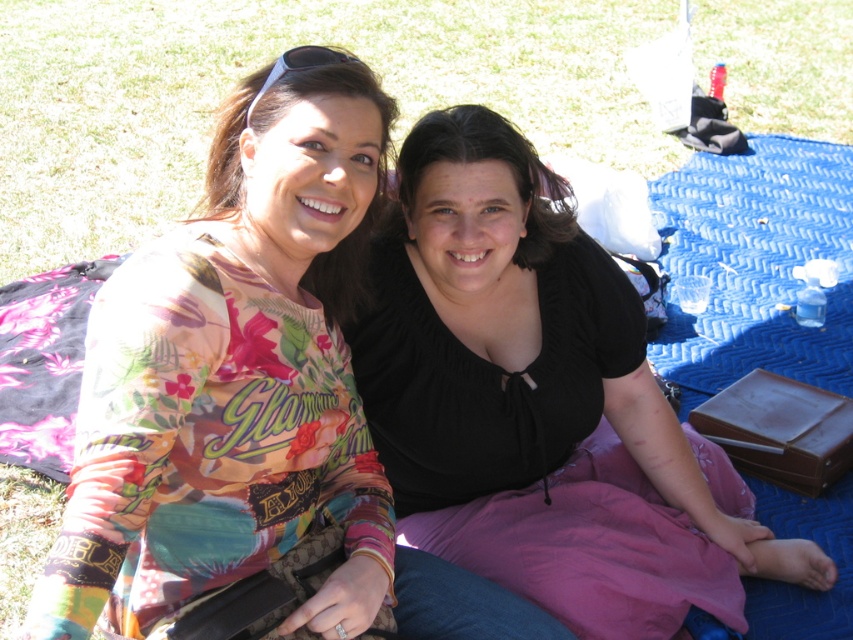
You are a photographer trying to capture a closeup of the floral printed shirt at center. Since the green grass at upper left is in the way, where should you position your camera relative to the shirt to avoid the grass blocking the view?

The floral printed shirt at center is below green grass at upper left, so positioning the camera above the shirt would allow you to capture the closeup without the grass blocking the view.

You are a fashion designer observing the two outfits in the image. You need to determine which outfit is shorter in length between the floral printed shirt at center and the black satin blouse at center. Which one is shorter?

The floral printed shirt at center is shorter than the black satin blouse at center, so the floral printed shirt at center is the shorter one.

You are a photographer trying to capture a clear photo of the black satin blouse at center without the floral printed shirt at center blocking it. How should you adjust your camera position?

Move the camera backward to create more distance between the floral printed shirt at center and the black satin blouse at center, allowing the black satin blouse at center to be visible without obstruction.